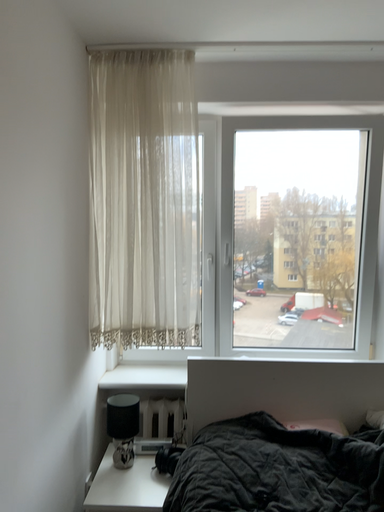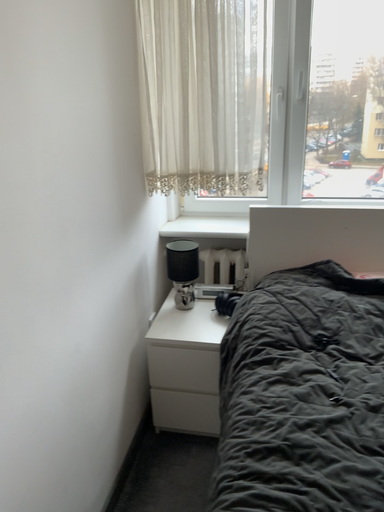
Question: Which way did the camera rotate in the video?

Choices:
 (A) rotated left
 (B) rotated right

Answer: (A)